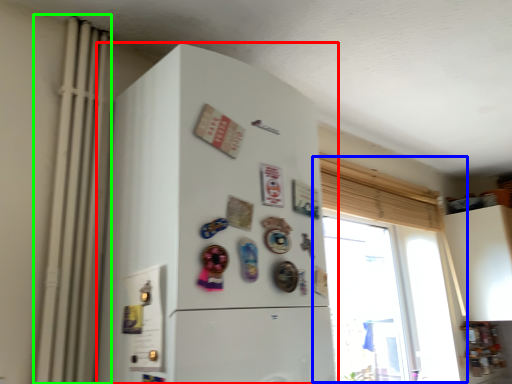
Question: Estimate the real-world distances between objects in this image. Which object is closer to refrigerator (highlighted by a red box), window (highlighted by a blue box) or radiator (highlighted by a green box)?

Choices:
 (A) window
 (B) radiator

Answer: (B)